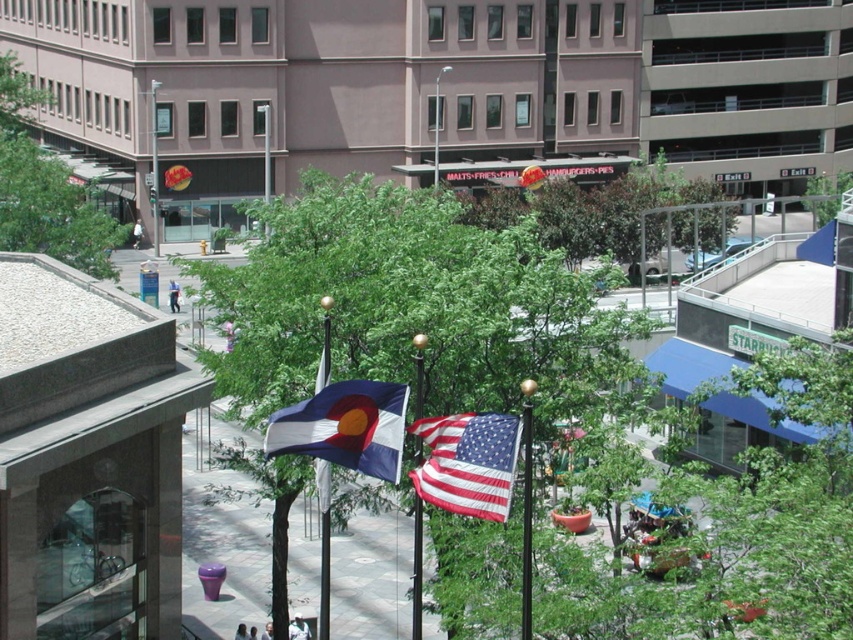
Question: Can you confirm if metallic flagpole at center is positioned above green leafy tree at center?

Choices:
 (A) no
 (B) yes

Answer: (A)

Question: Among these objects, which one is farthest from the camera?

Choices:
 (A) green leafy tree at upper left
 (B) american flag at center
 (C) metallic flagpole at center
 (D) green leafy tree at center

Answer: (D)

Question: Where is metallic flagpole at center located in relation to green leafy tree at center in the image?

Choices:
 (A) above
 (B) below

Answer: (B)

Question: Among these points, which one is nearest to the camera?

Choices:
 (A) 329,333
 (B) 422,397
 (C) 461,461

Answer: (C)

Question: Considering the relative positions of american flag at center and metallic flag pole at center in the image provided, where is american flag at center located with respect to metallic flag pole at center?

Choices:
 (A) below
 (B) above

Answer: (B)

Question: Which is farther from the metallic flagpole at center?

Choices:
 (A) metallic flag pole at center
 (B) green leafy tree at upper left

Answer: (B)